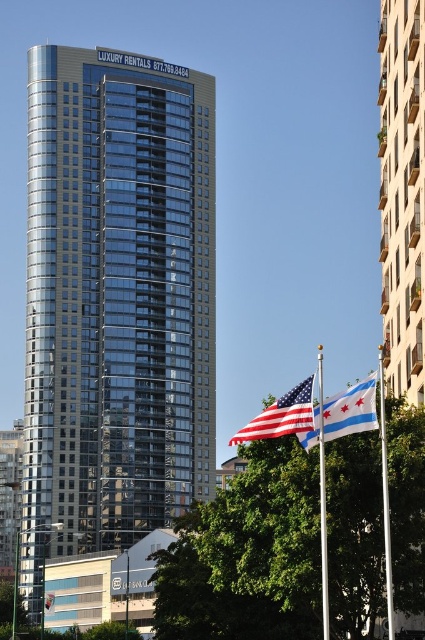
You are an architect designing a new building in the city. You need to ensure that the new building does not block the view of the blue and white striped fabric at center from the main road. Based on the coordinates provided, where should you place the new building to avoid obstructing this view?

The blue and white striped fabric at center is located at coordinates point (351, 410). To avoid blocking its view from the main road, the new building should be placed outside the line of sight from the main road to this point.

Consider the image. You are standing at the base of the skyscraper looking up. There are two points marked on the building facade. One is at coordinate point (418, 362) and the other at point (328, 440). Which point is closer to the top of the skyscraper?

Point (418, 362) is closer to the top of the skyscraper because it is located higher up on the building facade than point (328, 440).